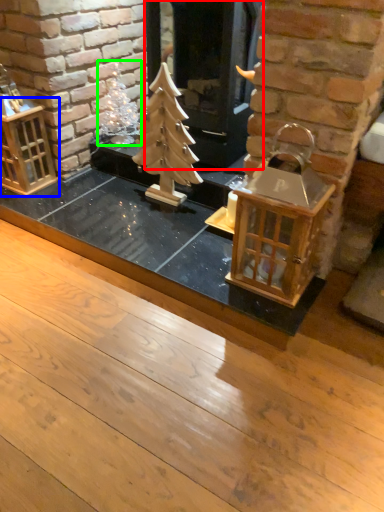
Question: Considering the real-world distances, which object is closest to fireplace (highlighted by a red box)? cage (highlighted by a blue box) or christmas decoration (highlighted by a green box).

Choices:
 (A) cage
 (B) christmas decoration

Answer: (B)